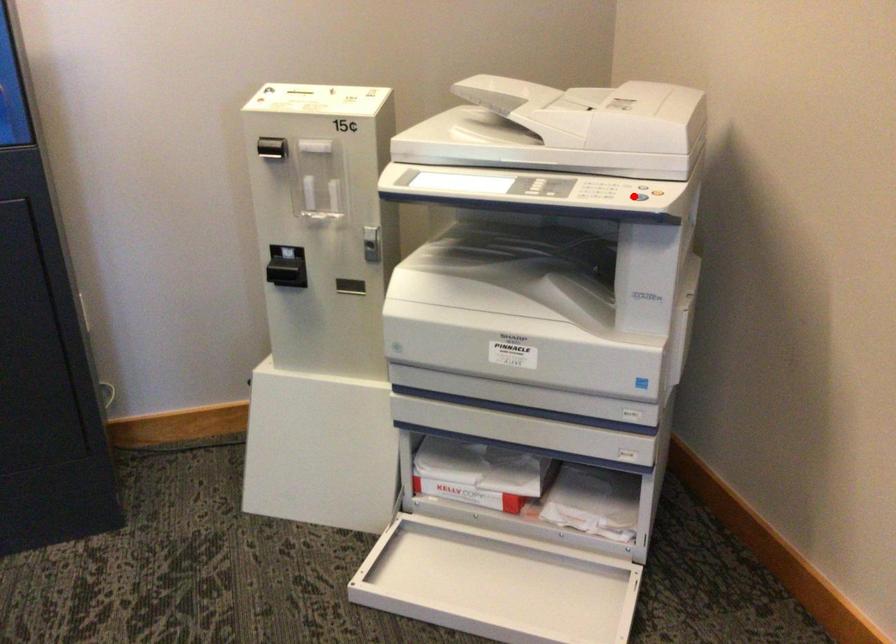
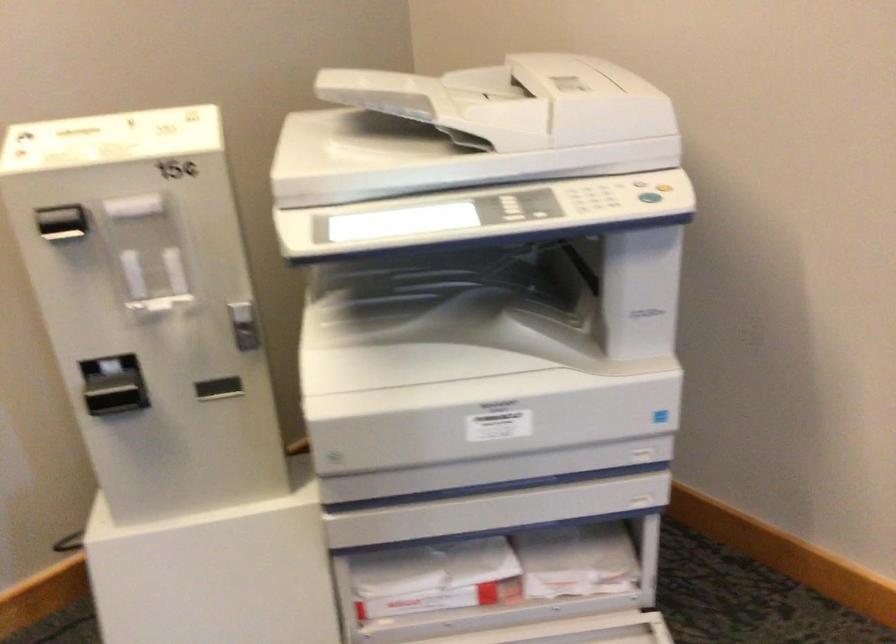
The point at the highlighted location is marked in the first image. Where is the corresponding point in the second image?

(649, 196)